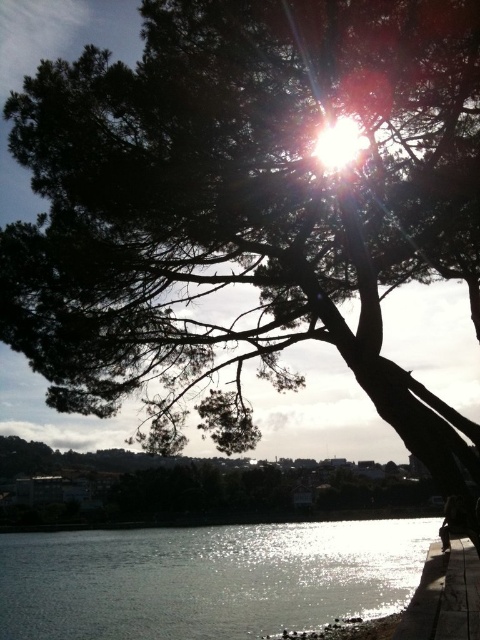
Question: Is glistening silver water at lower left closer to the viewer compared to smooth concrete ledge at lower right?

Choices:
 (A) no
 (B) yes

Answer: (A)

Question: Which of the following is the closest to the observer?

Choices:
 (A) glistening silver water at lower left
 (B) smooth concrete ledge at lower right

Answer: (B)

Question: Is glistening silver water at lower left closer to the viewer compared to smooth concrete ledge at lower right?

Choices:
 (A) yes
 (B) no

Answer: (B)

Question: Is glistening silver water at lower left thinner than smooth concrete ledge at lower right?

Choices:
 (A) no
 (B) yes

Answer: (A)